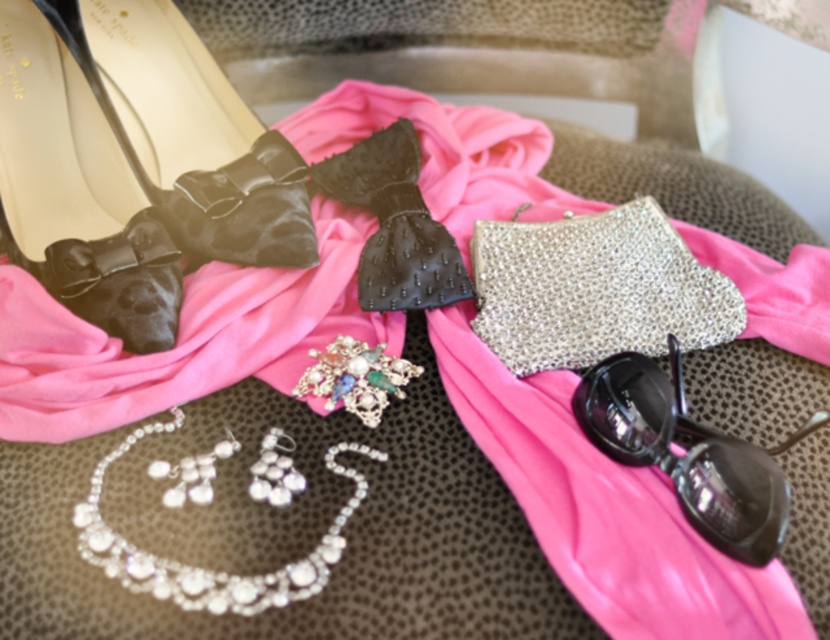
Which of these two, matte black bow at upper left or black plastic goggles at lower right, stands taller?

matte black bow at upper left is taller.

Is matte black bow at upper left above black plastic goggles at lower right?

Yes, matte black bow at upper left is above black plastic goggles at lower right.

Does point (120, 262) come farther from viewer compared to point (647, 429)?

Yes, point (120, 262) is behind point (647, 429).

Image resolution: width=830 pixels, height=640 pixels. In order to click on matte black bow at upper left in this screenshot , I will do `click(72, 204)`.

Between sparkly silver clutch at center and matte black bow at upper left, which one appears on the left side from the viewer's perspective?

matte black bow at upper left

Does sparkly silver clutch at center have a smaller size compared to matte black bow at upper left?

Correct, sparkly silver clutch at center occupies less space than matte black bow at upper left.

Who is more distant from viewer, [642,285] or [42,211]?

The point [642,285] is behind.

At what (x,y) coordinates should I click in order to perform the action: click on sparkly silver clutch at center. Please return your answer as a coordinate pair (x, y). The width and height of the screenshot is (830, 640). Looking at the image, I should click on (594, 289).

Based on the photo, is sparkly silver clutch at center smaller than pearl and gemstone brooch at center?

Incorrect, sparkly silver clutch at center is not smaller in size than pearl and gemstone brooch at center.

Is point (560, 262) positioned before point (349, 365)?

No, (560, 262) is behind (349, 365).

Which is behind, point (569, 276) or point (374, 419)?

The point (569, 276) is more distant.

Find the location of a particular element. This screenshot has width=830, height=640. sparkly silver clutch at center is located at coordinates (594, 289).